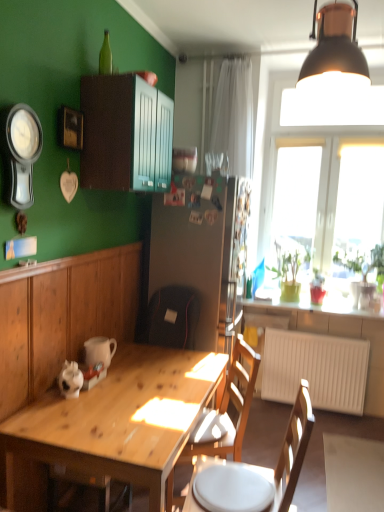
The image size is (384, 512). Find the location of `vacant region above wooden table at lower left, which is the second cabinetry in top-to-bottom order (from a real-world perspective)`. vacant region above wooden table at lower left, which is the second cabinetry in top-to-bottom order (from a real-world perspective) is located at coordinates (84, 247).